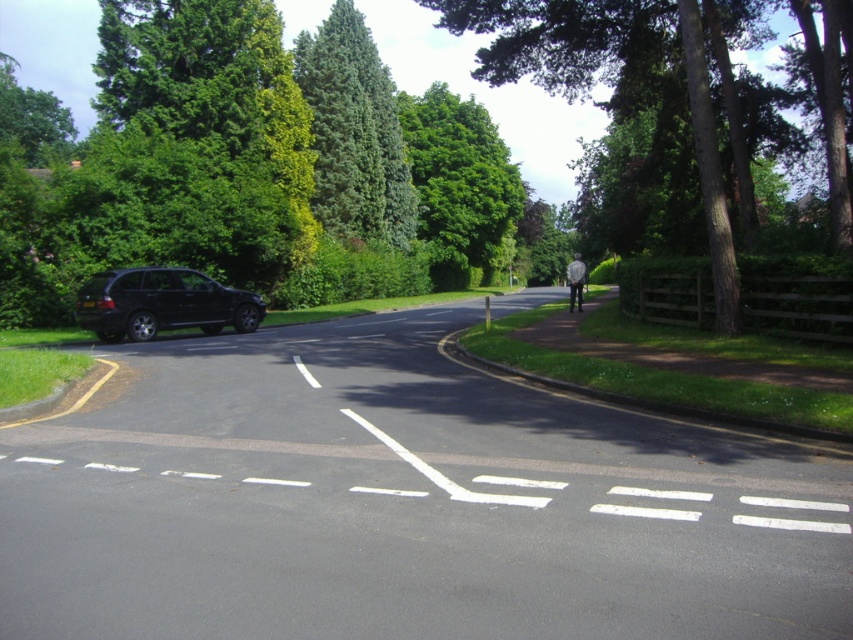
You are driving a car and see the black car at left and the green coniferous tree at upper center in your view. Which object is closer to you?

The black car at left is closer to you because it is in front of the green coniferous tree at upper center.

You are a delivery driver who needs to park your vehicle on the road. The road has a no parking zone marked by white dashed lines. You see a black car at left and a green coniferous tree at upper center. Can you safely park your vehicle between them without violating the no parking zone?

The black car at left is wider than the green coniferous tree at upper center. However, parking between them may still violate the no parking zone indicated by the white dashed lines. You should avoid parking on the road where the no parking zone is marked.

You are a driver approaching the curve in the road. You see the black car at left and the green coniferous tree at upper center. Which object is closer to you?

The black car at left is closer to you because it appears smaller than the green coniferous tree at upper center, which is further away.